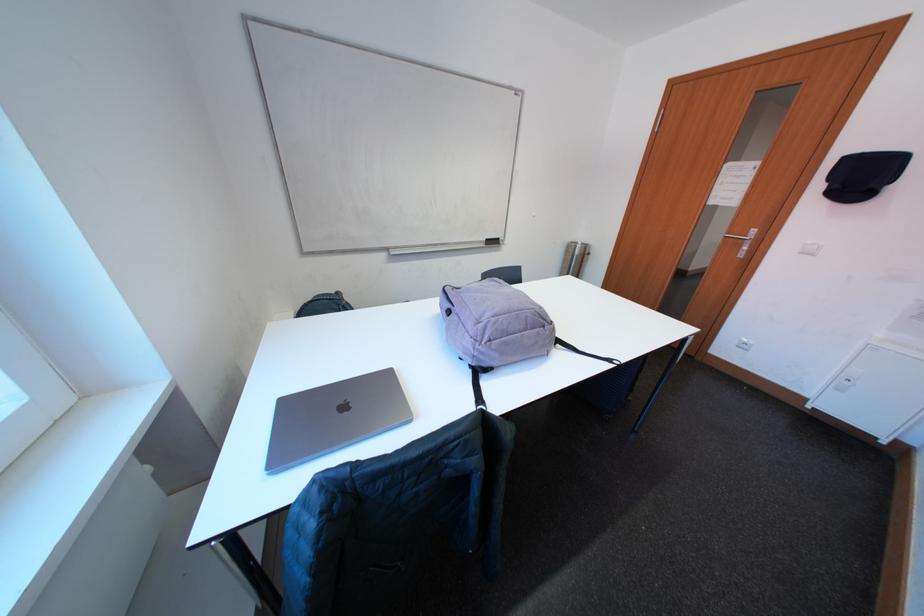
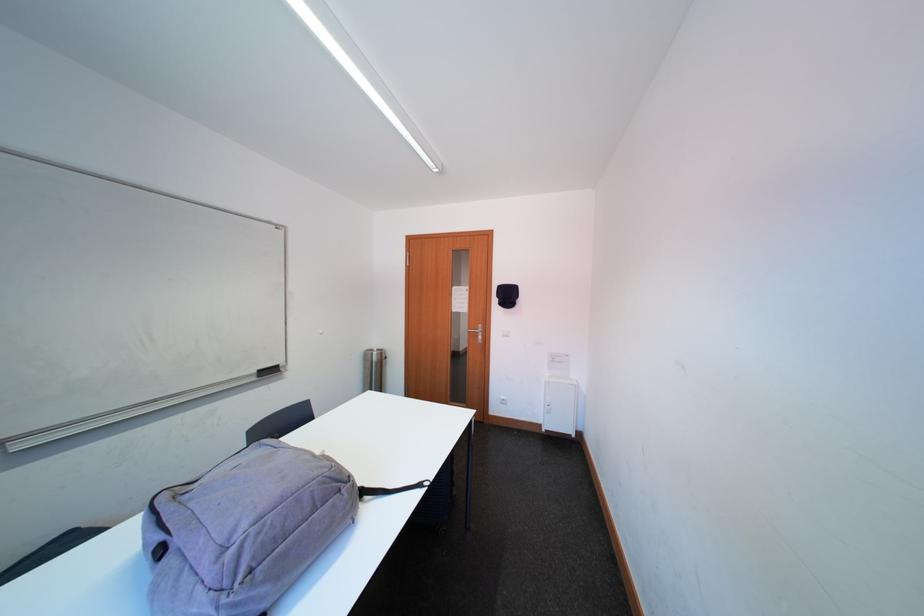
In the second image, find the point that corresponds to the point at 815,403 in the first image.

(551, 429)